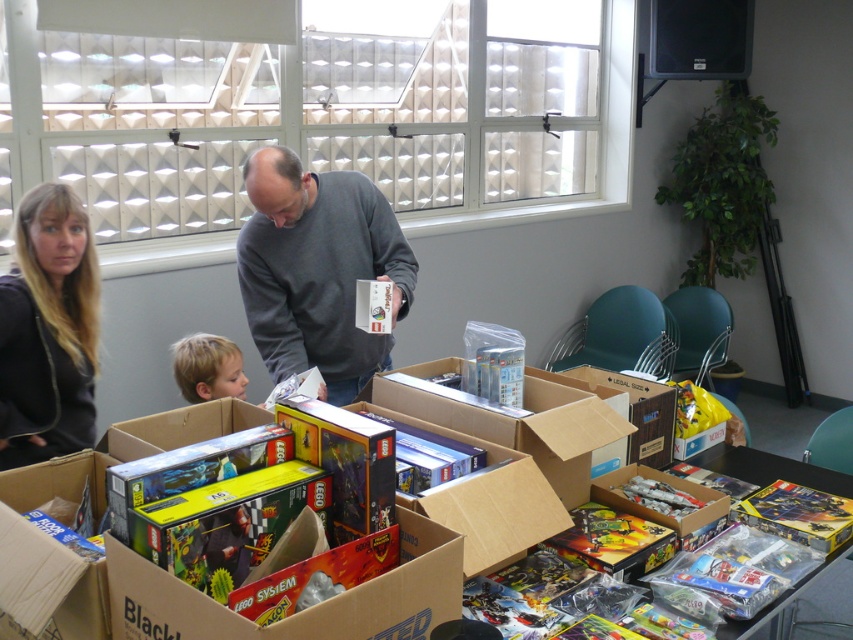
Who is lower down, gray matte shirt at center or brown cardboard box at center?

brown cardboard box at center

Is gray matte shirt at center below brown cardboard box at center?

No, gray matte shirt at center is not below brown cardboard box at center.

At what (x,y) coordinates should I click in order to perform the action: click on gray matte shirt at center. Please return your answer as a coordinate pair (x, y). The width and height of the screenshot is (853, 640). Looking at the image, I should click on (318, 269).

Does matte black hoodie at left have a lesser width compared to cardboard box at center?

Indeed, matte black hoodie at left has a lesser width compared to cardboard box at center.

Between matte black hoodie at left and cardboard box at center, which one has more height?

With more height is matte black hoodie at left.

I want to click on matte black hoodie at left, so click(48, 330).

Does gray matte shirt at center lie in front of blonde hair at lower left?

Yes, gray matte shirt at center is in front of blonde hair at lower left.

Can you confirm if gray matte shirt at center is bigger than blonde hair at lower left?

Yes, gray matte shirt at center is bigger than blonde hair at lower left.

Between point (264, 259) and point (184, 384), which one is positioned in front?

Point (264, 259) is more forward.

This screenshot has height=640, width=853. What are the coordinates of `gray matte shirt at center` in the screenshot? It's located at click(318, 269).